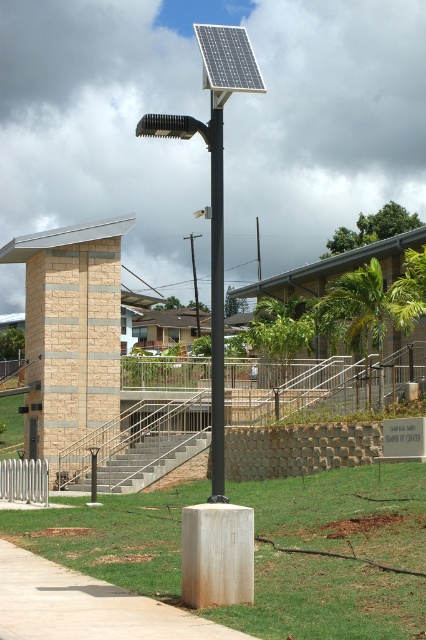
Consider the image. Does black matte solar panel at center have a lesser height compared to black metal pole at center?

No.

Does black matte solar panel at center have a smaller size compared to black metal pole at center?

No.

Does point (219, 65) come in front of point (222, 484)?

No, (219, 65) is behind (222, 484).

Identify the location of black matte solar panel at center. (213, 189).

This screenshot has width=426, height=640. What do you see at coordinates (86, 605) in the screenshot?
I see `smooth concrete sidewalk at lower left` at bounding box center [86, 605].

Does smooth concrete sidewalk at lower left appear on the right side of black matte solar panel at center?

Correct, you'll find smooth concrete sidewalk at lower left to the right of black matte solar panel at center.

Find the location of a particular element. The width and height of the screenshot is (426, 640). smooth concrete sidewalk at lower left is located at coordinates (86, 605).

You are a GUI agent. You are given a task and a screenshot of the screen. Output one action in this format:
    pyautogui.click(x=<x>, y=<y>)
    Task: Click on the smooth concrete sidewalk at lower left
    This screenshot has height=640, width=426.
    Given the screenshot: What is the action you would take?
    pyautogui.click(x=86, y=605)

Who is more forward, (x=101, y=630) or (x=224, y=61)?

Point (x=101, y=630) is more forward.

The width and height of the screenshot is (426, 640). Describe the element at coordinates (86, 605) in the screenshot. I see `smooth concrete sidewalk at lower left` at that location.

Between point (92, 604) and point (227, 64), which one is positioned behind?

The point (227, 64) is behind.

Where is `smooth concrete sidewalk at lower left`? smooth concrete sidewalk at lower left is located at coordinates (86, 605).